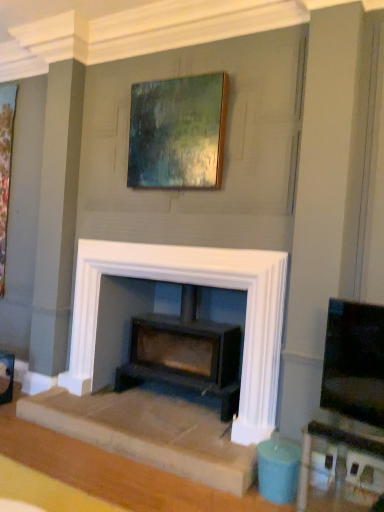
Question: Is matte white table at lower right oriented away from wooden frame at upper center, the 1th picture frame from the right?

Choices:
 (A) yes
 (B) no

Answer: (B)

Question: Considering the relative sizes of matte white table at lower right and wooden frame at upper center, which is counted as the first picture frame, starting from the front, in the image provided, is matte white table at lower right taller than wooden frame at upper center, which is counted as the first picture frame, starting from the front,?

Choices:
 (A) yes
 (B) no

Answer: (B)

Question: Is matte white table at lower right positioned beyond the bounds of wooden frame at upper center, the 1th picture frame from the right?

Choices:
 (A) no
 (B) yes

Answer: (B)

Question: Is there a large distance between matte white table at lower right and wooden frame at upper center, positioned as the 2th picture frame in back-to-front order?

Choices:
 (A) no
 (B) yes

Answer: (B)

Question: Would you say matte white table at lower right contains wooden frame at upper center, which is counted as the first picture frame, starting from the front?

Choices:
 (A) yes
 (B) no

Answer: (B)

Question: Can you confirm if matte white table at lower right is thinner than wooden frame at upper center, which is counted as the first picture frame, starting from the front?

Choices:
 (A) yes
 (B) no

Answer: (B)

Question: From a real-world perspective, does white stone fireplace at center sit lower than matte black tv at right?

Choices:
 (A) no
 (B) yes

Answer: (B)

Question: Does white stone fireplace at center have a greater height compared to matte black tv at right?

Choices:
 (A) yes
 (B) no

Answer: (A)

Question: Does white stone fireplace at center have a lesser width compared to matte black tv at right?

Choices:
 (A) no
 (B) yes

Answer: (A)

Question: From the image's perspective, would you say white stone fireplace at center is shown under matte black tv at right?

Choices:
 (A) no
 (B) yes

Answer: (A)

Question: From the image's perspective, is white stone fireplace at center on matte black tv at right?

Choices:
 (A) yes
 (B) no

Answer: (A)

Question: Does white stone fireplace at center have a greater width compared to matte black tv at right?

Choices:
 (A) no
 (B) yes

Answer: (B)

Question: From a real-world perspective, is wooden picture frame at left, which appears as the first picture frame when viewed from the back, on matte black wood burning stove at center?

Choices:
 (A) yes
 (B) no

Answer: (A)